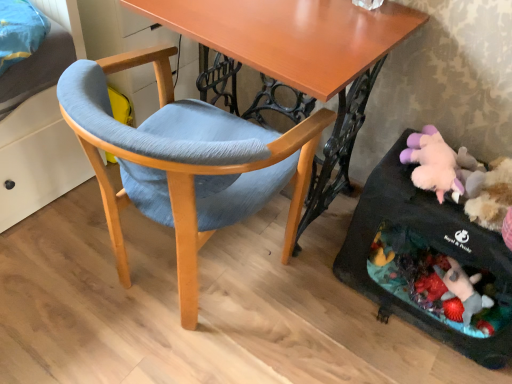
In order to click on free space to the left of matte blue fabric chair at center in this screenshot , I will do `click(54, 260)`.